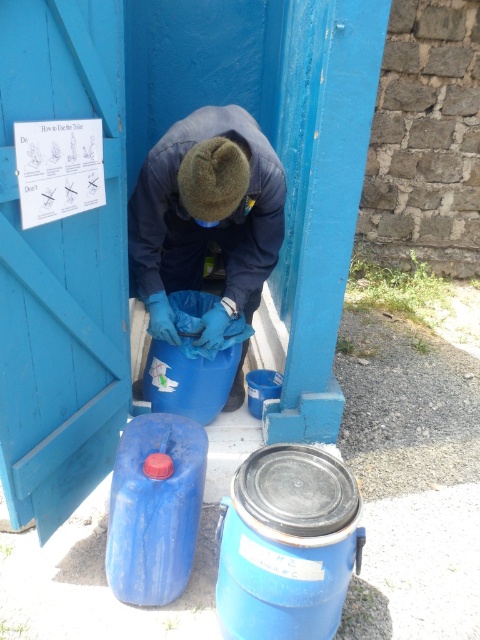
Question: Does blue matte gloves at center appear over blue plastic barrel at lower left?

Choices:
 (A) yes
 (B) no

Answer: (A)

Question: Which object is farther from the camera taking this photo?

Choices:
 (A) blue plastic barrel at lower left
 (B) blue matte gloves at center

Answer: (B)

Question: Which object is closer to the camera taking this photo?

Choices:
 (A) blue plastic barrel at lower left
 (B) blue matte gloves at center

Answer: (A)

Question: Observing the image, what is the correct spatial positioning of blue matte gloves at center in reference to blue plastic barrel at lower left?

Choices:
 (A) above
 (B) below

Answer: (A)

Question: Does blue matte gloves at center appear on the left side of blue plastic barrel at lower left?

Choices:
 (A) yes
 (B) no

Answer: (B)